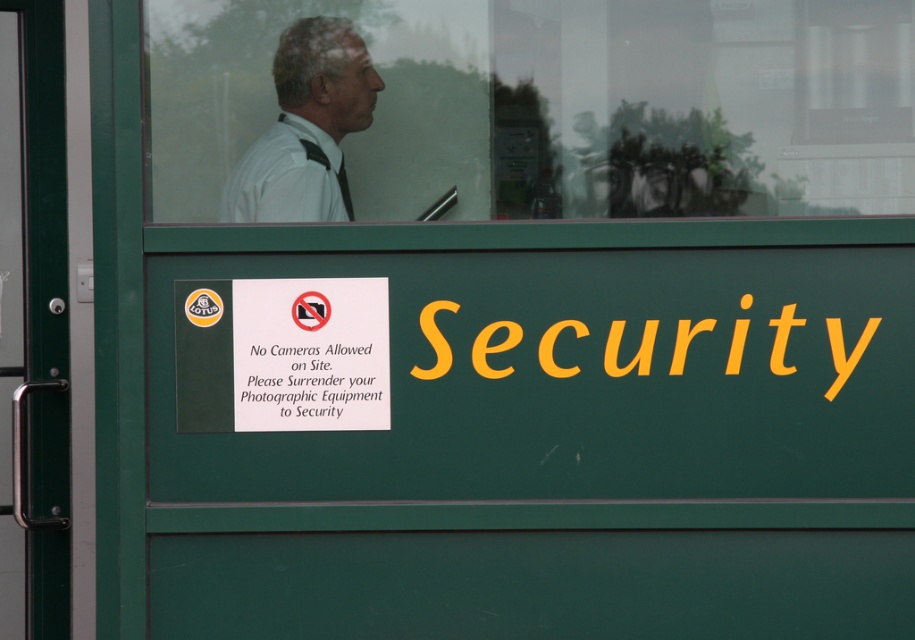
Is point (68, 560) farther from viewer compared to point (388, 424)?

Yes, it is.

Between green metallic door at left and white paper at upper center, which one has more height?

green metallic door at left

At what (x,y) coordinates should I click in order to perform the action: click on green metallic door at left. Please return your answer as a coordinate pair (x, y). Image resolution: width=915 pixels, height=640 pixels. Looking at the image, I should click on (42, 177).

Is yellow matte security at center further to the viewer compared to white matte dress shirt at upper center?

No.

Is point (700, 326) positioned behind point (324, 166)?

No, (700, 326) is in front of (324, 166).

Locate an element on the screen. The image size is (915, 640). yellow matte security at center is located at coordinates (634, 355).

Which is in front, point (239, 74) or point (294, 384)?

Point (294, 384)

Consider the image. Is transparent glass window at upper center positioned in front of white paper at upper center?

No, it is behind white paper at upper center.

Find the location of a particular element. The height and width of the screenshot is (640, 915). transparent glass window at upper center is located at coordinates (535, 108).

Identify the location of transparent glass window at upper center. (535, 108).